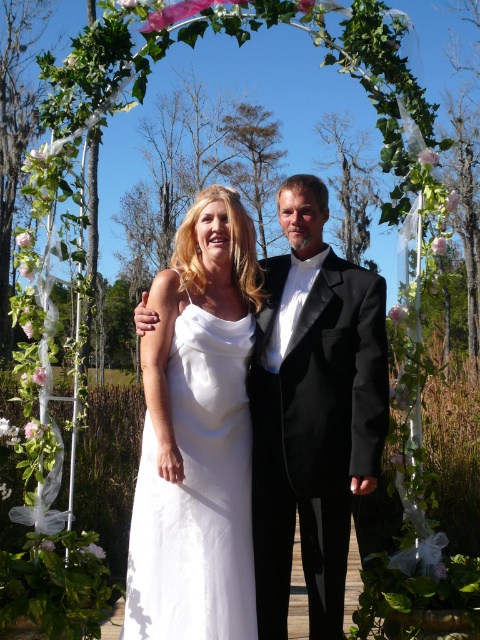
Does white satin dress at center have a smaller size compared to black satin tuxedo at center?

Yes.

Does white satin dress at center have a lesser width compared to black satin tuxedo at center?

No.

You are a GUI agent. You are given a task and a screenshot of the screen. Output one action in this format:
    pyautogui.click(x=<x>, y=<y>)
    Task: Click on the white satin dress at center
    
    Given the screenshot: What is the action you would take?
    pyautogui.click(x=196, y=435)

Where is `white satin dress at center`? Image resolution: width=480 pixels, height=640 pixels. white satin dress at center is located at coordinates (196, 435).